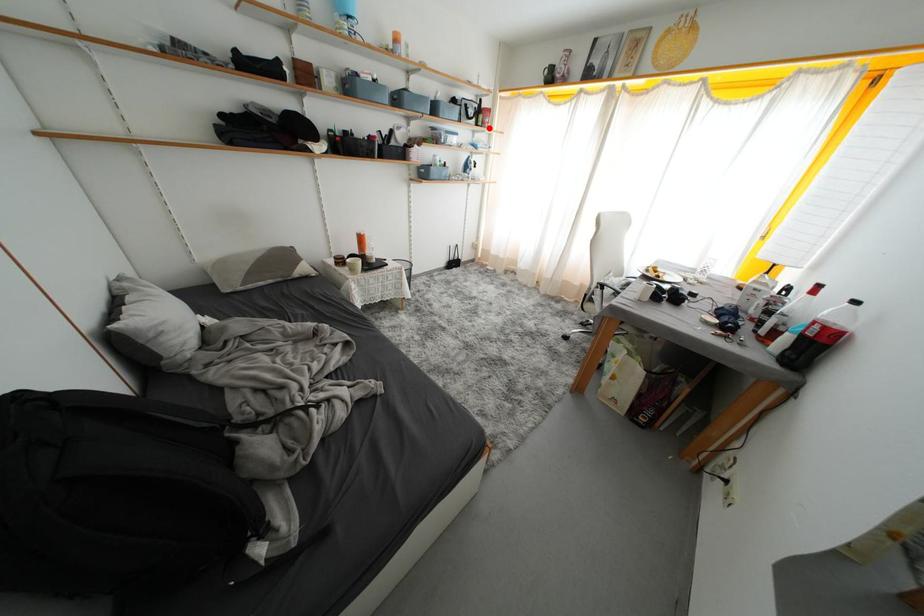
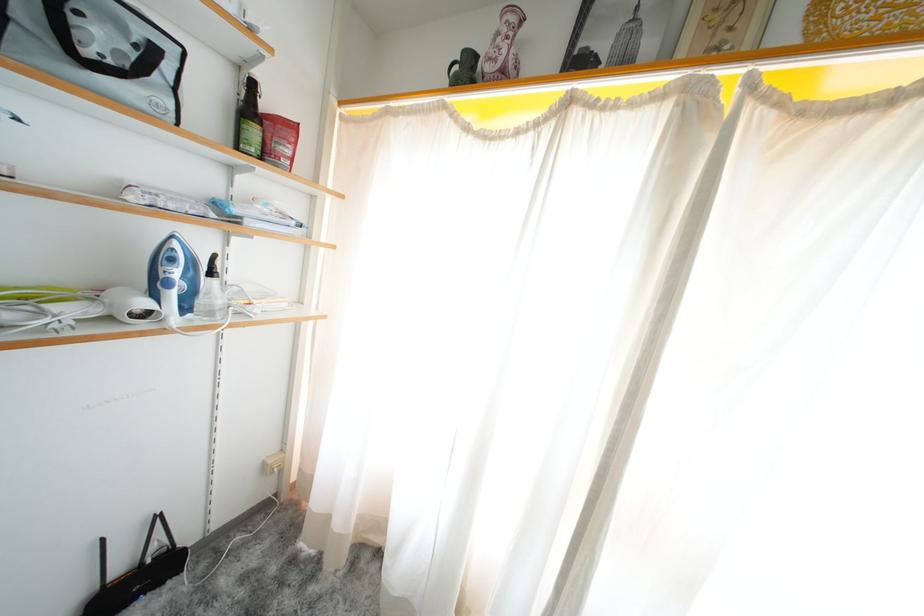
The point at the highlighted location is marked in the first image. Where is the corresponding point in the second image?

(273, 158)